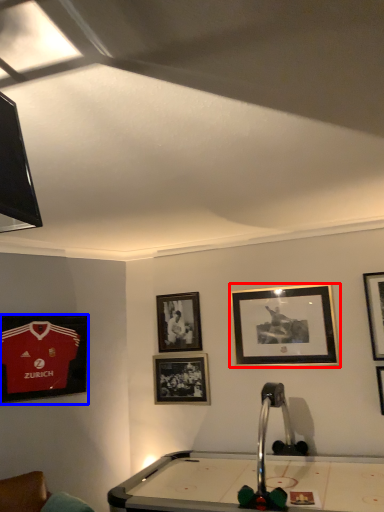
Question: Which object is closer to the camera taking this photo, picture frame (highlighted by a red box) or picture frame (highlighted by a blue box)?

Choices:
 (A) picture frame
 (B) picture frame

Answer: (B)